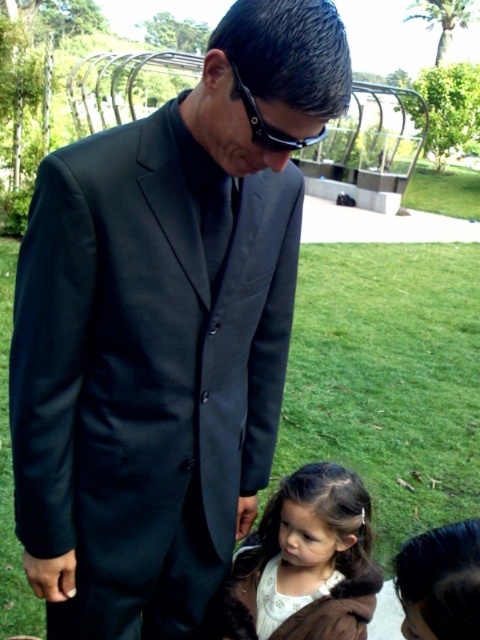
Question: Which of the following is the closest to the observer?

Choices:
 (A) (248, 115)
 (B) (342, 113)

Answer: (B)

Question: Can you confirm if matte black suit at center is positioned to the right of black plastic goggles at center?

Choices:
 (A) no
 (B) yes

Answer: (A)

Question: Which of these objects is positioned closest to the white satin dress at lower center?

Choices:
 (A) brown fur coat at lower right
 (B) black plastic goggles at center
 (C) white fur coat at lower center
 (D) matte black suit at center

Answer: (C)

Question: Is white satin dress at lower center thinner than black plastic goggles at center?

Choices:
 (A) yes
 (B) no

Answer: (B)

Question: From the image, what is the correct spatial relationship of matte black suit at center in relation to white satin dress at lower center?

Choices:
 (A) above
 (B) below

Answer: (A)

Question: Which object appears closest to the camera in this image?

Choices:
 (A) black plastic goggles at center
 (B) white satin dress at lower center

Answer: (A)